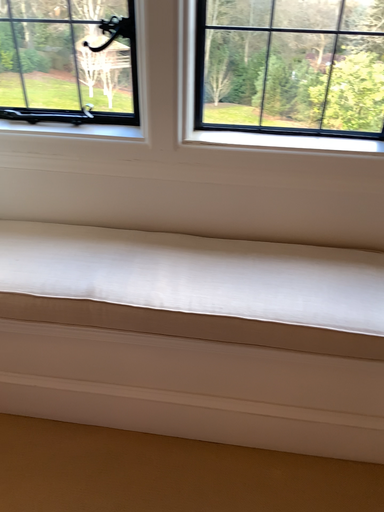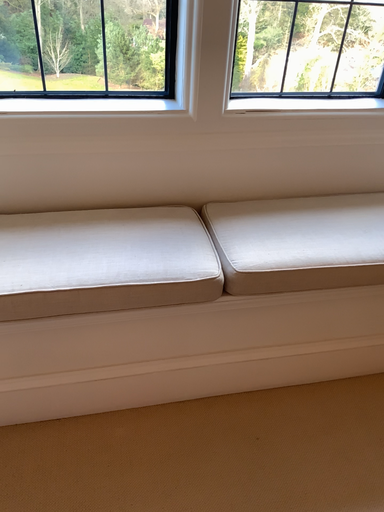
Question: Which way did the camera rotate in the video?

Choices:
 (A) rotated left
 (B) rotated right

Answer: (B)